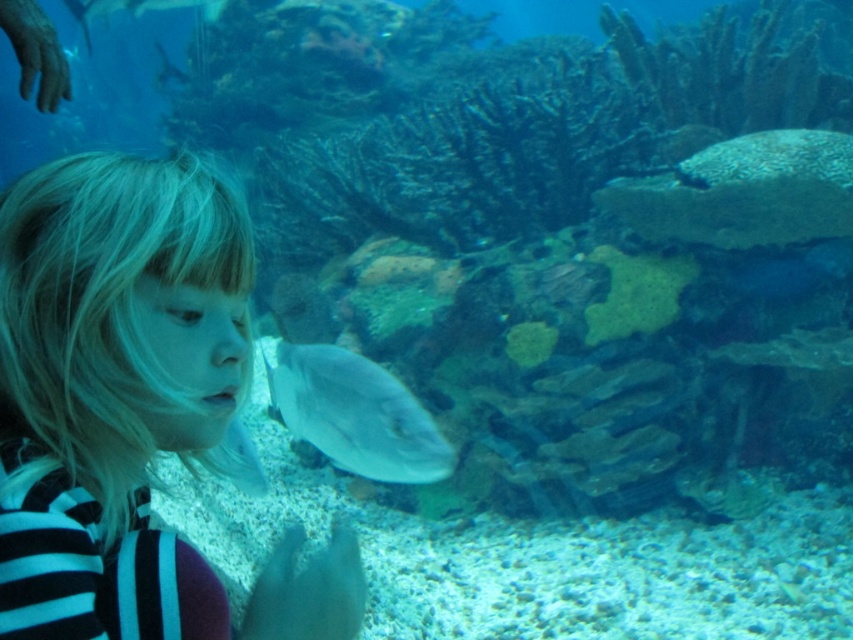
Where is `blonde hair at left`? blonde hair at left is located at coordinates (131, 406).

Can you confirm if blonde hair at left is positioned below shiny silver fish at center?

Actually, blonde hair at left is above shiny silver fish at center.

Does point (84, 540) lie in front of point (305, 381)?

Yes, it is in front of point (305, 381).

Locate an element on the screen. Image resolution: width=853 pixels, height=640 pixels. blonde hair at left is located at coordinates (131, 406).